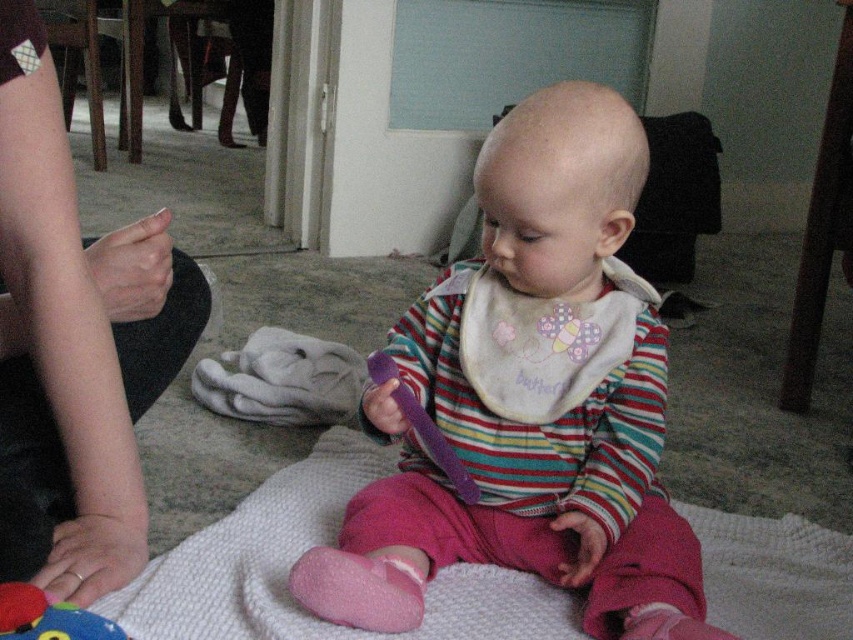
What is the position of the soft plush toy at lower left in the image?

The soft plush toy at lower left is located at point [48,618].

You are a caregiver holding a 12 inch long baby bottle. You want to place it between the matte purple spoon at center and the soft plush toy at lower left so that it touches both objects. Is this possible?

The distance between the matte purple spoon at center and the soft plush toy at lower left is 19.06 inches. The baby bottle is 12 inches long, which is shorter than the distance between them. Therefore, placing the bottle to touch both objects is not possible as it cannot span the required distance.

The baby is holding a purple object in their right hand. The adult is reaching towards the baby with their left hand. Where is the matte purple spoon at center located in the frame?

The matte purple spoon at center is located at the coordinates point (531, 400) in the frame.